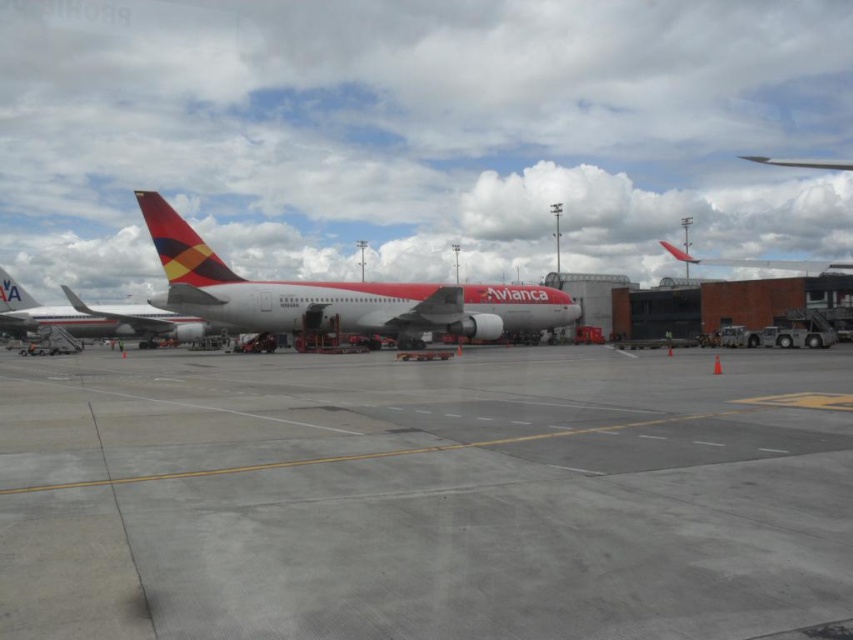
Question: Considering the relative positions of gray concrete tarmac at center and metallic red airplane at upper center in the image provided, where is gray concrete tarmac at center located with respect to metallic red airplane at upper center?

Choices:
 (A) above
 (B) below

Answer: (B)

Question: Can you confirm if gray concrete tarmac at center is smaller than matte red airplane at center?

Choices:
 (A) no
 (B) yes

Answer: (B)

Question: Which object is positioned closest to the matte red airplane at center?

Choices:
 (A) metallic red airplane at upper center
 (B) gray concrete tarmac at center

Answer: (B)

Question: Among these objects, which one is farthest from the camera?

Choices:
 (A) gray concrete tarmac at center
 (B) metallic red airplane at upper center

Answer: (B)

Question: Is matte red airplane at center to the right of metallic red airplane at upper center from the viewer's perspective?

Choices:
 (A) yes
 (B) no

Answer: (B)

Question: Which of the following is the closest to the observer?

Choices:
 (A) gray concrete tarmac at center
 (B) matte red airplane at center
 (C) metallic red airplane at upper center

Answer: (A)